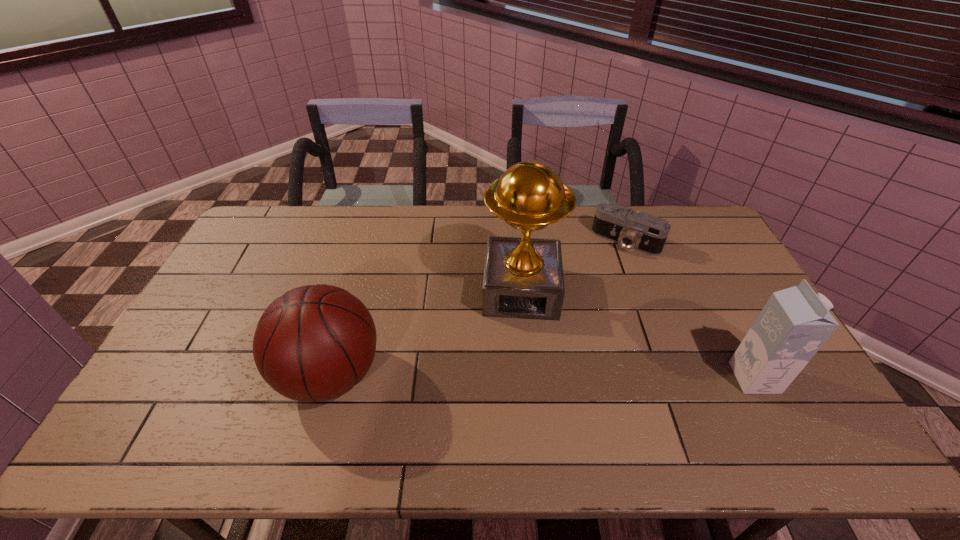
The image size is (960, 540). I want to click on vacant space at the left edge, so click(199, 331).

Where is `vacant space at the far left corner of the desktop`? vacant space at the far left corner of the desktop is located at coordinates (279, 211).

Locate an element on the screen. vacant area at the near left corner of the desktop is located at coordinates (147, 414).

I want to click on vacant space at the far right corner, so click(x=689, y=230).

This screenshot has width=960, height=540. Find the location of `vacant space in between the basketball and the third object from right to left`. vacant space in between the basketball and the third object from right to left is located at coordinates (426, 333).

Find the location of `vacant area that lies between the award and the leftmost object`. vacant area that lies between the award and the leftmost object is located at coordinates (426, 333).

You are a GUI agent. You are given a task and a screenshot of the screen. Output one action in this format:
    pyautogui.click(x=<x>, y=<y>)
    Task: Click on the unoccupied area between the basketball and the second farthest object
    This screenshot has height=540, width=960.
    Given the screenshot: What is the action you would take?
    pyautogui.click(x=426, y=333)

The height and width of the screenshot is (540, 960). In order to click on vacant space that's between the shortest object and the basketball in this screenshot , I will do `click(478, 308)`.

Where is `unoccupied position between the leftmost object and the award`? This screenshot has height=540, width=960. unoccupied position between the leftmost object and the award is located at coordinates (426, 333).

Where is `free space between the rightmost object and the shortest object`? free space between the rightmost object and the shortest object is located at coordinates (690, 309).